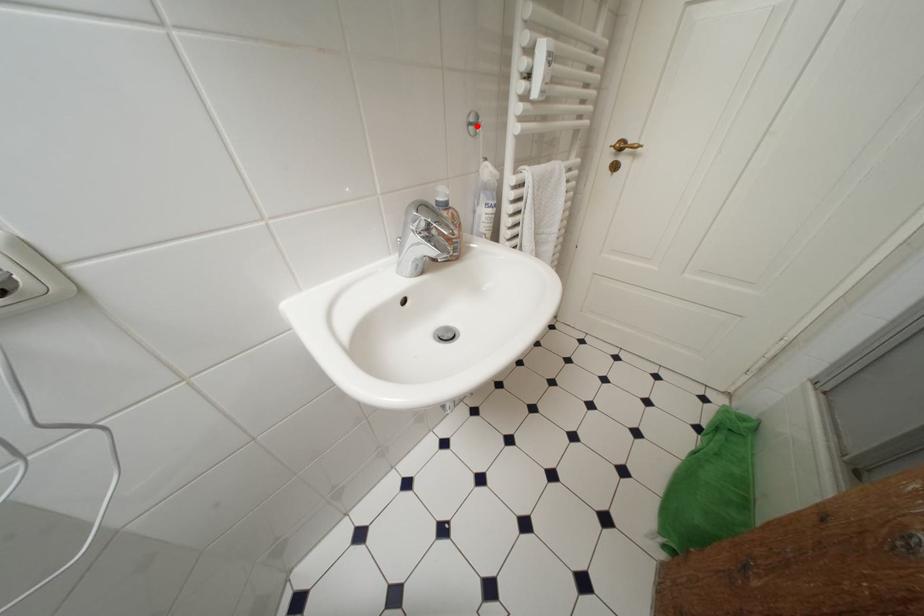
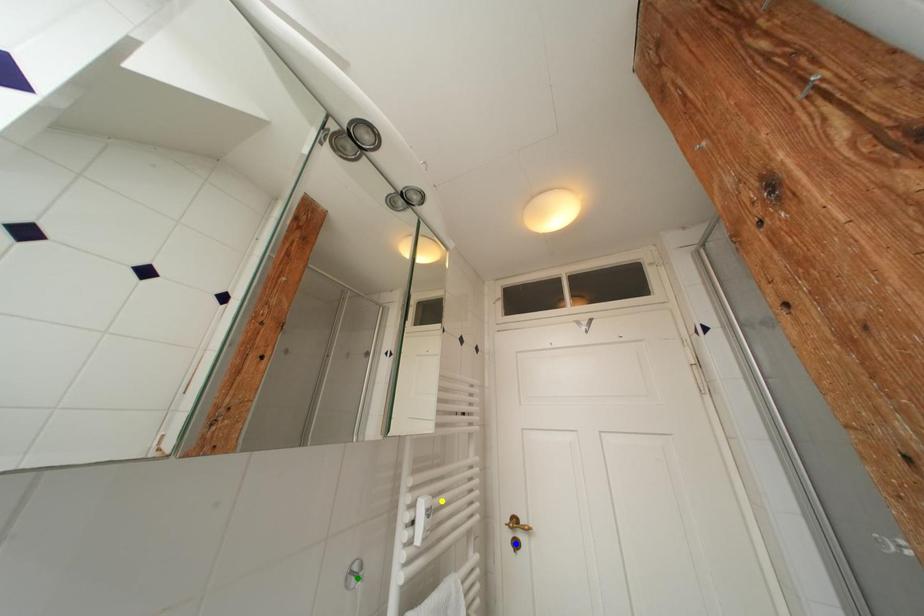
Question: I am providing you with two images of the same scene from different viewpoints. A red point is marked on the first image. You are given multiple points on the second image. Which point in image 2 represents the same 3d spot as the red point in image 1?

Choices:
 (A) yellow point
 (B) green point
 (C) blue point

Answer: (B)